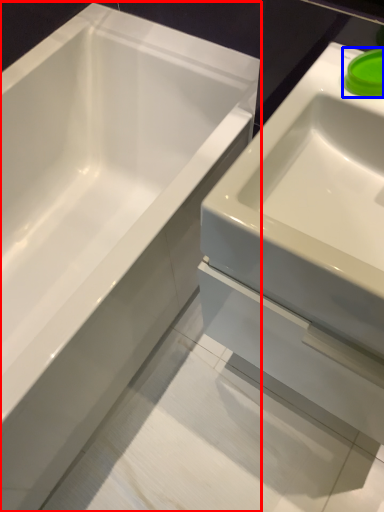
Question: Which object is further to the camera taking this photo, bathtub (highlighted by a red box) or liquid (highlighted by a blue box)?

Choices:
 (A) bathtub
 (B) liquid

Answer: (B)